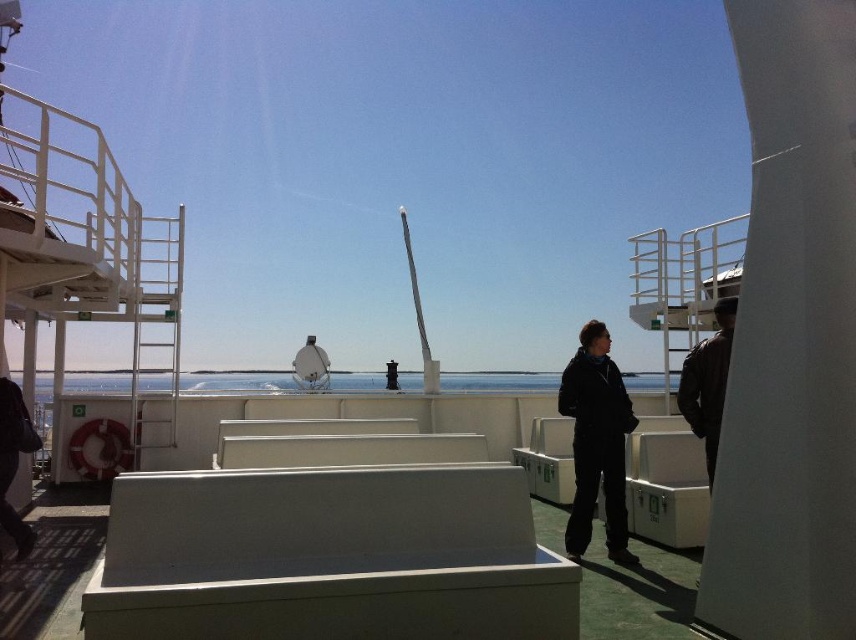
Question: Can you confirm if black matte jacket at center is positioned above dark brown leather jacket at right?

Choices:
 (A) yes
 (B) no

Answer: (B)

Question: Can you confirm if black matte jacket at center is bigger than dark brown leather jacket at right?

Choices:
 (A) no
 (B) yes

Answer: (B)

Question: In this image, where is black matte jacket at center located relative to dark brown leather jacket at right?

Choices:
 (A) below
 (B) above

Answer: (A)

Question: Which point is closer to the camera?

Choices:
 (A) black matte jacket at center
 (B) dark brown leather jacket at right

Answer: (B)